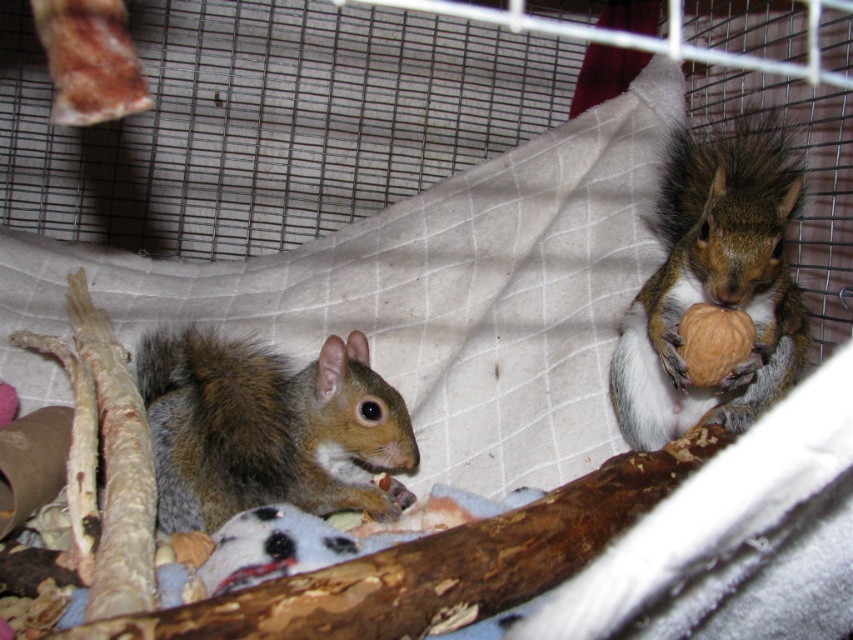
Question: Does shiny brown fur at right appear on the right side of brown fuzzy squirrel at center?

Choices:
 (A) yes
 (B) no

Answer: (A)

Question: Which of the following is the farthest from the observer?

Choices:
 (A) shiny brown fur at right
 (B) brown fuzzy squirrel at center

Answer: (A)

Question: Is shiny brown fur at right to the left of brown fuzzy squirrel at center from the viewer's perspective?

Choices:
 (A) yes
 (B) no

Answer: (B)

Question: From the image, what is the correct spatial relationship of shiny brown fur at right in relation to brown fuzzy squirrel at center?

Choices:
 (A) right
 (B) left

Answer: (A)

Question: Which object is farther from the camera taking this photo?

Choices:
 (A) shiny brown fur at right
 (B) brown fuzzy squirrel at center

Answer: (A)